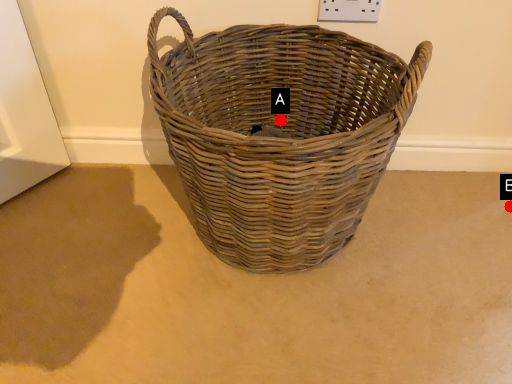
Question: Two points are circled on the image, labeled by A and B beside each circle. Which point is farther to the camera?

Choices:
 (A) A is further
 (B) B is further

Answer: (A)